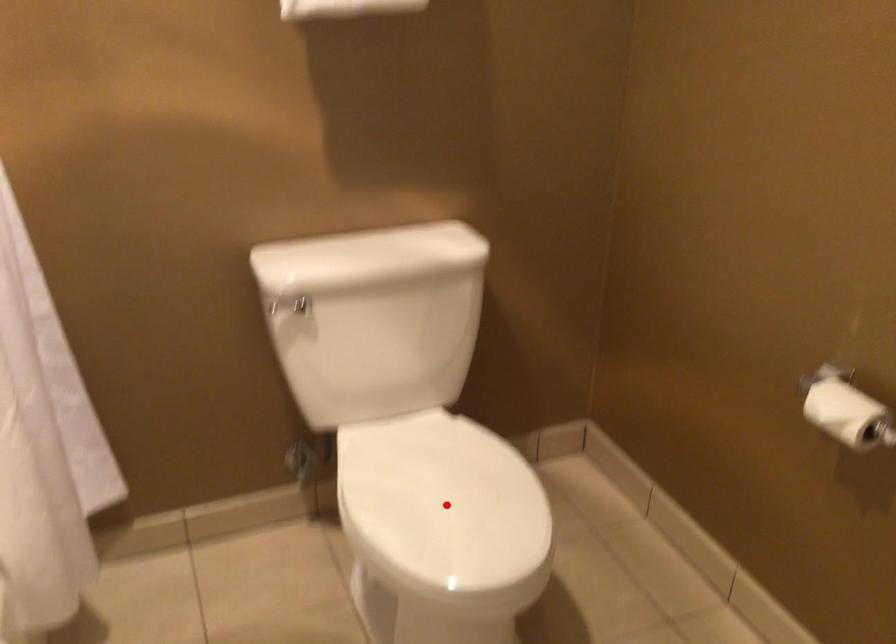
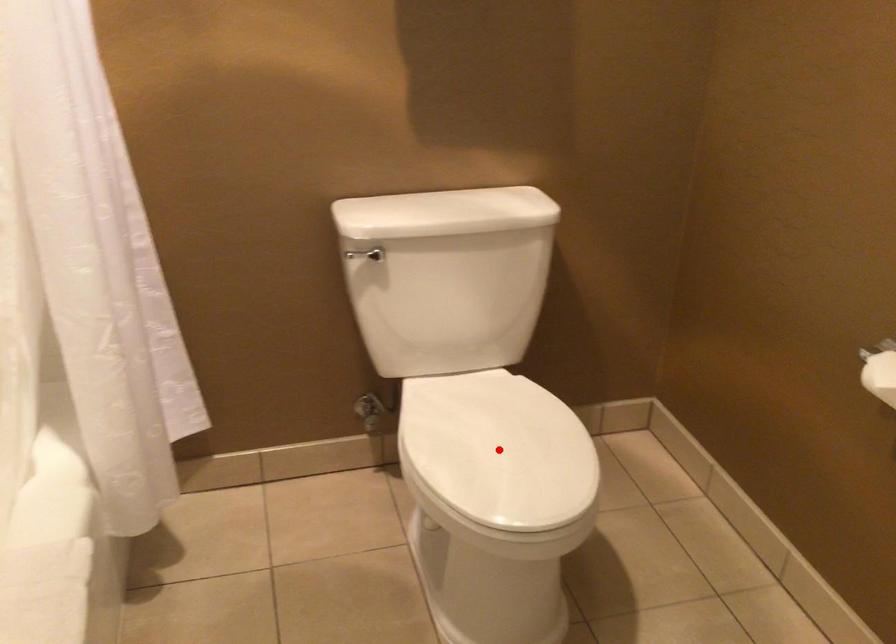
I am providing you with two images of the same scene from different viewpoints. A red point is marked on the first image and another point is marked on the second image. Do the highlighted points in image1 and image2 indicate the same real-world spot?

Yes